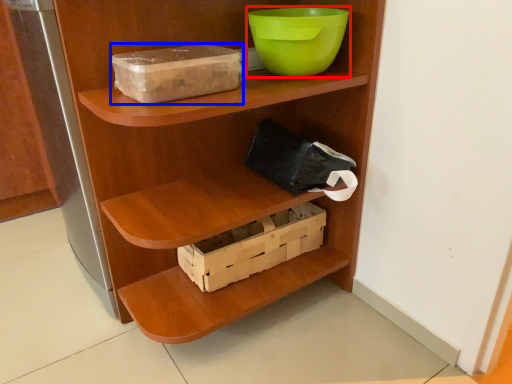
Question: Which object appears closest to the camera in this image, bowl (highlighted by a red box) or storage box (highlighted by a blue box)?

Choices:
 (A) bowl
 (B) storage box

Answer: (B)